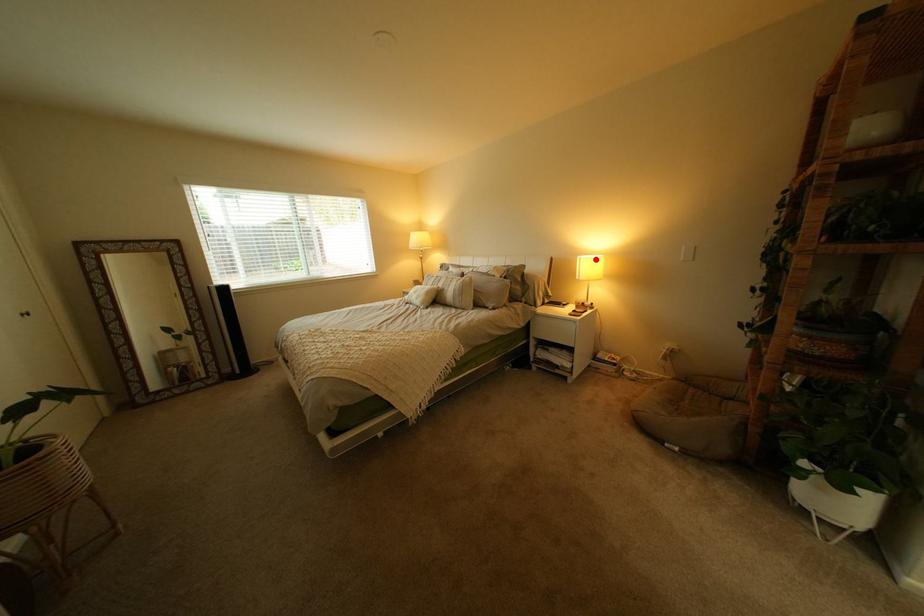
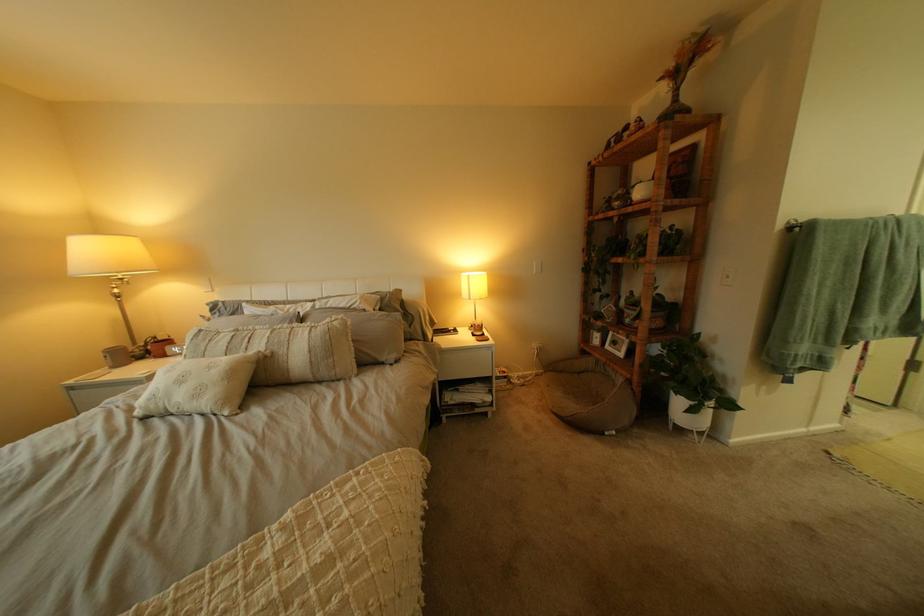
Question: I am providing you with two images of the same scene from different viewpoints. Image1 has a red point marked. In image2, the corresponding 3D location appears at what relative position? Reply with the corresponding letter.

Choices:
 (A) Closer
 (B) Farther

Answer: (B)